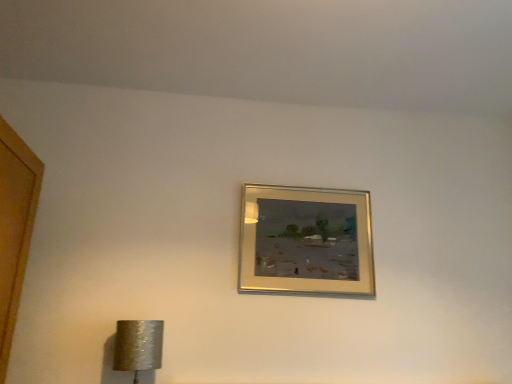
Locate an element on the screen. This screenshot has width=512, height=384. gold metallic picture frame at upper center is located at coordinates (306, 241).

What do you see at coordinates (306, 241) in the screenshot?
I see `gold metallic picture frame at upper center` at bounding box center [306, 241].

This screenshot has height=384, width=512. Describe the element at coordinates (138, 346) in the screenshot. I see `silver textured lampshade at lower left` at that location.

This screenshot has height=384, width=512. Identify the location of silver textured lampshade at lower left. (138, 346).

The image size is (512, 384). I want to click on gold metallic picture frame at upper center, so click(x=306, y=241).

Looking at this image, considering the relative positions of silver textured lampshade at lower left and gold metallic picture frame at upper center in the image provided, is silver textured lampshade at lower left to the right of gold metallic picture frame at upper center from the viewer's perspective?

No.

Considering the relative positions of silver textured lampshade at lower left and gold metallic picture frame at upper center in the image provided, is silver textured lampshade at lower left behind gold metallic picture frame at upper center?

No, the depth of silver textured lampshade at lower left is less than that of gold metallic picture frame at upper center.

Is point (148, 369) closer to viewer compared to point (354, 275)?

That is True.

From the image's perspective, relative to gold metallic picture frame at upper center, is silver textured lampshade at lower left above or below?

Based on their image positions, silver textured lampshade at lower left is located beneath gold metallic picture frame at upper center.

From a real-world perspective, which object rests below the other?

In real-world perspective, silver textured lampshade at lower left is lower.

Between silver textured lampshade at lower left and gold metallic picture frame at upper center, which one has larger width?

With larger width is silver textured lampshade at lower left.

Consider the image. Which of these two, silver textured lampshade at lower left or gold metallic picture frame at upper center, stands taller?

gold metallic picture frame at upper center is taller.

Considering the sizes of silver textured lampshade at lower left and gold metallic picture frame at upper center in the image, is silver textured lampshade at lower left bigger or smaller than gold metallic picture frame at upper center?

Considering their sizes, silver textured lampshade at lower left takes up less space than gold metallic picture frame at upper center.

Looking at this image, would you say silver textured lampshade at lower left contains gold metallic picture frame at upper center?

No, gold metallic picture frame at upper center is not a part of silver textured lampshade at lower left.

Is silver textured lampshade at lower left positioned far away from gold metallic picture frame at upper center?

No, silver textured lampshade at lower left is in close proximity to gold metallic picture frame at upper center.

Does silver textured lampshade at lower left turn towards gold metallic picture frame at upper center?

No, silver textured lampshade at lower left is not facing towards gold metallic picture frame at upper center.

At what (x,y) coordinates should I click in order to perform the action: click on picture frame above the silver textured lampshade at lower left (from the image's perspective). Please return your answer as a coordinate pair (x, y). This screenshot has height=384, width=512. Looking at the image, I should click on (306, 241).

Based on the photo, does gold metallic picture frame at upper center appear on the left side of silver textured lampshade at lower left?

No.

Which object is further away from the camera taking this photo, gold metallic picture frame at upper center or silver textured lampshade at lower left?

gold metallic picture frame at upper center.

Which is behind, point (291, 288) or point (124, 354)?

The point (291, 288) is more distant.

From the image's perspective, which object appears higher, gold metallic picture frame at upper center or silver textured lampshade at lower left?

gold metallic picture frame at upper center, from the image's perspective.

From a real-world perspective, is gold metallic picture frame at upper center above or below silver textured lampshade at lower left?

In terms of real-world spatial position, gold metallic picture frame at upper center is above silver textured lampshade at lower left.

In the scene shown: Considering the relative sizes of gold metallic picture frame at upper center and silver textured lampshade at lower left in the image provided, is gold metallic picture frame at upper center wider than silver textured lampshade at lower left?

No, gold metallic picture frame at upper center is not wider than silver textured lampshade at lower left.

From their relative heights in the image, would you say gold metallic picture frame at upper center is taller or shorter than silver textured lampshade at lower left?

Considering their sizes, gold metallic picture frame at upper center has more height than silver textured lampshade at lower left.

Based on the photo, considering the sizes of objects gold metallic picture frame at upper center and silver textured lampshade at lower left in the image provided, who is smaller, gold metallic picture frame at upper center or silver textured lampshade at lower left?

silver textured lampshade at lower left.

Is gold metallic picture frame at upper center spatially inside silver textured lampshade at lower left, or outside of it?

The correct answer is: outside.

From the picture: Is gold metallic picture frame at upper center far from silver textured lampshade at lower left?

No.

Is gold metallic picture frame at upper center facing towards silver textured lampshade at lower left?

No, gold metallic picture frame at upper center is not facing towards silver textured lampshade at lower left.

What's the angular difference between gold metallic picture frame at upper center and silver textured lampshade at lower left's facing directions?

gold metallic picture frame at upper center and silver textured lampshade at lower left are facing 0.00805 degrees away from each other.

Where is `lamp that appears below the gold metallic picture frame at upper center (from a real-world perspective)`? The width and height of the screenshot is (512, 384). lamp that appears below the gold metallic picture frame at upper center (from a real-world perspective) is located at coordinates (138, 346).

The width and height of the screenshot is (512, 384). What are the coordinates of `lamp below the gold metallic picture frame at upper center (from a real-world perspective)` in the screenshot? It's located at (138, 346).

You are a GUI agent. You are given a task and a screenshot of the screen. Output one action in this format:
    pyautogui.click(x=<x>, y=<y>)
    Task: Click on the picture frame located above the silver textured lampshade at lower left (from a real-world perspective)
    
    Given the screenshot: What is the action you would take?
    pyautogui.click(x=306, y=241)